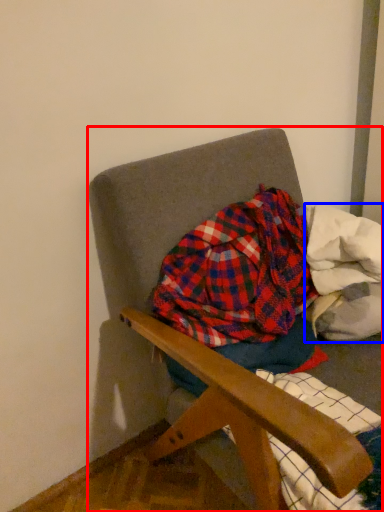
Question: Among these objects, which one is nearest to the camera, chair (highlighted by a red box) or material (highlighted by a blue box)?

Choices:
 (A) chair
 (B) material

Answer: (A)